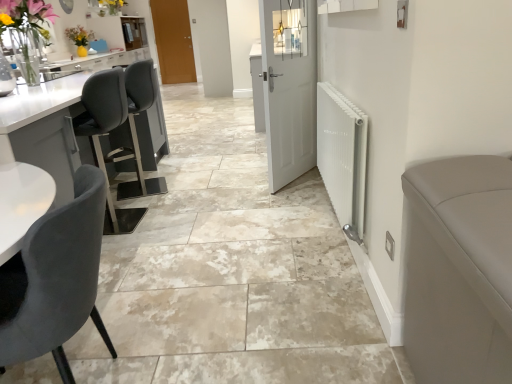
In order to click on vacant space underneath white matte door at center, the 1th door from the bottom (from a real-world perspective) in this screenshot , I will do `click(294, 180)`.